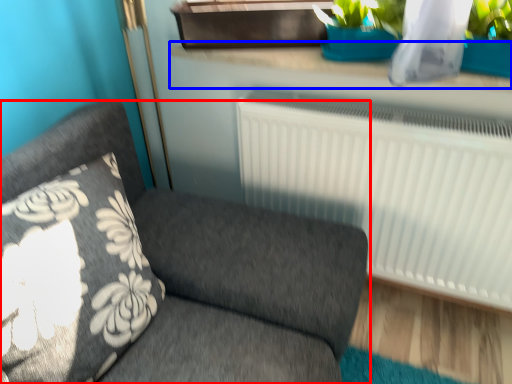
Question: Which object is closer to the camera taking this photo, furniture (highlighted by a red box) or window sill (highlighted by a blue box)?

Choices:
 (A) furniture
 (B) window sill

Answer: (A)